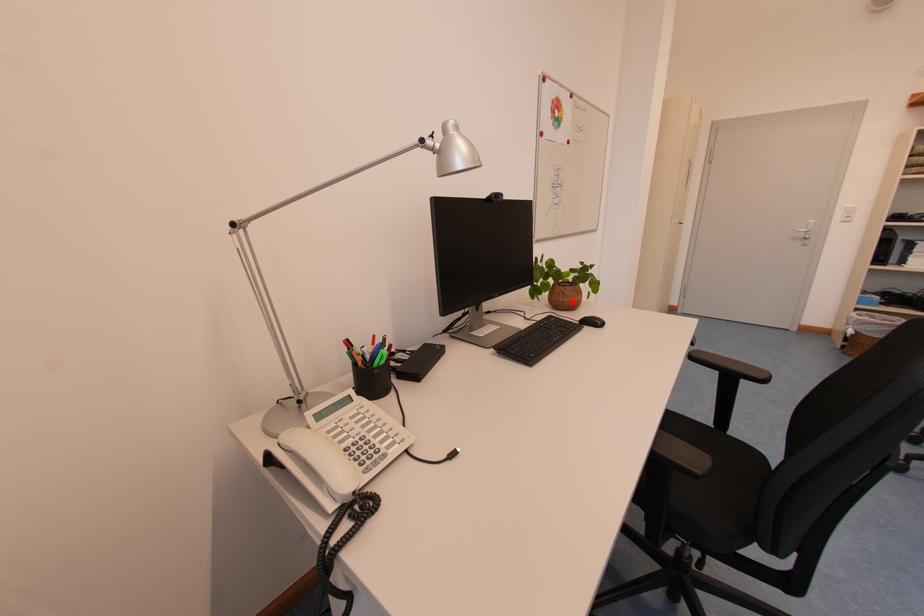
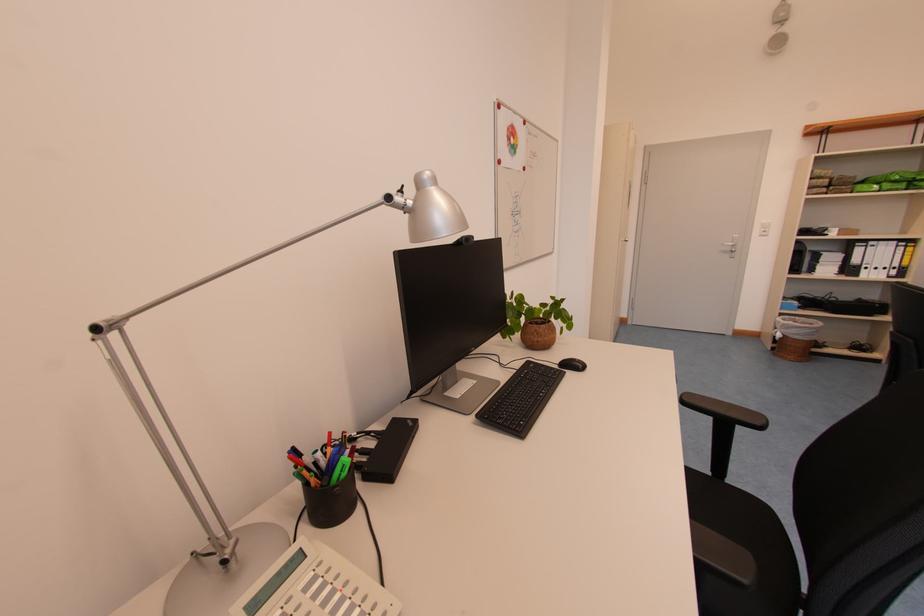
Find the pixel in the second image that matches the highlighted location in the first image.

(546, 342)